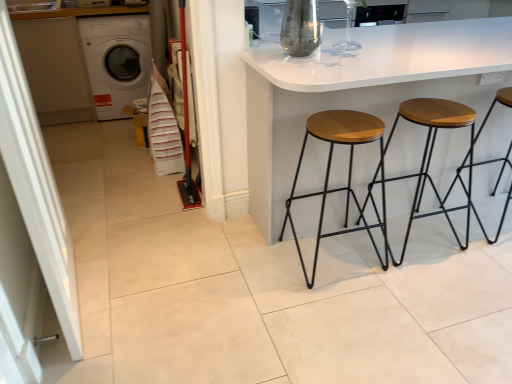
Where is `wooden/metallic stool at center, which is counted as the second stool, starting from the left`? This screenshot has width=512, height=384. wooden/metallic stool at center, which is counted as the second stool, starting from the left is located at coordinates tap(430, 157).

What do you see at coordinates (430, 157) in the screenshot? Image resolution: width=512 pixels, height=384 pixels. I see `wooden/metallic stool at center, which is counted as the second stool, starting from the left` at bounding box center [430, 157].

This screenshot has width=512, height=384. What are the coordinates of `wooden barstools at center` in the screenshot? It's located at (359, 90).

Image resolution: width=512 pixels, height=384 pixels. What do you see at coordinates (163, 129) in the screenshot? I see `white striped fabric at left` at bounding box center [163, 129].

Describe the element at coordinates (348, 173) in the screenshot. I see `woodenmaterial/texturestool at center, the 1th stool from the left` at that location.

This screenshot has width=512, height=384. Find the location of `woodenmaterial/texturestool at center, the 1th stool from the left`. woodenmaterial/texturestool at center, the 1th stool from the left is located at coordinates (348, 173).

What do you see at coordinates (348, 31) in the screenshot?
I see `transparent glass vase at upper center` at bounding box center [348, 31].

Find the location of a particular element. The width and height of the screenshot is (512, 384). wooden/metallic stool at center, which is counted as the second stool, starting from the left is located at coordinates (430, 157).

Consider the image. Can you tell me how much woodenmaterial/texturestool at center, marked as the 3th stool in a right-to-left arrangement, and transparent glass vase at upper center differ in facing direction?

There is a 178-degree angle between the facing directions of woodenmaterial/texturestool at center, marked as the 3th stool in a right-to-left arrangement, and transparent glass vase at upper center.

Which object is closer to the camera, woodenmaterial/texturestool at center, the 1th stool from the left, or transparent glass vase at upper center?

woodenmaterial/texturestool at center, the 1th stool from the left, is more forward.

Which is correct: woodenmaterial/texturestool at center, the 1th stool from the left, is inside transparent glass vase at upper center, or outside of it?

woodenmaterial/texturestool at center, the 1th stool from the left, is located beyond the bounds of transparent glass vase at upper center.

Does woodenmaterial/texturestool at center, marked as the 3th stool in a right-to-left arrangement, have a lesser height compared to transparent glass vase at upper center?

Incorrect, the height of woodenmaterial/texturestool at center, marked as the 3th stool in a right-to-left arrangement, does not fall short of that of transparent glass vase at upper center.

Visually, is wooden/metallic stool at center, which is counted as the second stool, starting from the left, positioned to the left or to the right of white striped fabric at left?

wooden/metallic stool at center, which is counted as the second stool, starting from the left, is positioned on white striped fabric at left's right side.

Who is taller, wooden/metallic stool at center, marked as the second stool in a right-to-left arrangement, or white striped fabric at left?

With more height is wooden/metallic stool at center, marked as the second stool in a right-to-left arrangement.

Is the surface of wooden/metallic stool at center, marked as the second stool in a right-to-left arrangement, in direct contact with white striped fabric at left?

wooden/metallic stool at center, marked as the second stool in a right-to-left arrangement, and white striped fabric at left are clearly separated.

From a real-world perspective, who is located higher, wooden/metallic stool at center, which is counted as the second stool, starting from the left, or white striped fabric at left?

From a 3D spatial view, wooden/metallic stool at center, which is counted as the second stool, starting from the left, is above.

Based on their positions, is wooden/metallic stool at center, marked as the second stool in a right-to-left arrangement, located to the left or right of white glossy washing machine at left?

In the image, wooden/metallic stool at center, marked as the second stool in a right-to-left arrangement, appears on the right side of white glossy washing machine at left.

Is point (453, 228) in front of point (111, 18)?

Yes.

Is wooden/metallic stool at center, marked as the second stool in a right-to-left arrangement, aimed at white glossy washing machine at left?

No, wooden/metallic stool at center, marked as the second stool in a right-to-left arrangement, is not facing towards white glossy washing machine at left.

From the image's perspective, is wooden/metallic stool at center, which is counted as the second stool, starting from the left, beneath white glossy washing machine at left?

Yes.

Where is `the 2nd stool below the wooden seat at right, the 3th stool in the left-to-right sequence (from the image's perspective)`? This screenshot has height=384, width=512. the 2nd stool below the wooden seat at right, the 3th stool in the left-to-right sequence (from the image's perspective) is located at coordinates (348, 173).

Is woodenmaterial/texturestool at center, marked as the 3th stool in a right-to-left arrangement, not close to wooden seat at right, positioned as the first stool in right-to-left order?

No, woodenmaterial/texturestool at center, marked as the 3th stool in a right-to-left arrangement, is in close proximity to wooden seat at right, positioned as the first stool in right-to-left order.

Which is farther, (297, 177) or (507, 100)?

The point (507, 100) is farther.

Which object is closer to the camera taking this photo, woodenmaterial/texturestool at center, the 1th stool from the left, or wooden seat at right, positioned as the first stool in right-to-left order?

woodenmaterial/texturestool at center, the 1th stool from the left, is more forward.

Is point (500, 93) more distant than point (320, 118)?

Yes, point (500, 93) is farther from viewer.

Would you say wooden seat at right, positioned as the first stool in right-to-left order, contains woodenmaterial/texturestool at center, the 1th stool from the left?

No, wooden seat at right, positioned as the first stool in right-to-left order, does not contain woodenmaterial/texturestool at center, the 1th stool from the left.

From a real-world perspective, is wooden seat at right, the 3th stool in the left-to-right sequence, under woodenmaterial/texturestool at center, the 1th stool from the left?

Correct, in the physical world, wooden seat at right, the 3th stool in the left-to-right sequence, is lower than woodenmaterial/texturestool at center, the 1th stool from the left.

Between wooden seat at right, the 3th stool in the left-to-right sequence, and woodenmaterial/texturestool at center, the 1th stool from the left, which one has smaller width?

Thinner between the two is woodenmaterial/texturestool at center, the 1th stool from the left.

Locate an element on the screen. The width and height of the screenshot is (512, 384). table located above the wooden/metallic stool at center, marked as the second stool in a right-to-left arrangement (from the image's perspective) is located at coordinates (359, 90).

Between wooden barstools at center and wooden/metallic stool at center, which is counted as the second stool, starting from the left, which one has smaller size?

wooden/metallic stool at center, which is counted as the second stool, starting from the left, is smaller.

Can you confirm if wooden barstools at center is shorter than wooden/metallic stool at center, which is counted as the second stool, starting from the left?

No.

Is wooden barstools at center facing away from wooden/metallic stool at center, which is counted as the second stool, starting from the left?

Correct, wooden barstools at center is looking away from wooden/metallic stool at center, which is counted as the second stool, starting from the left.

This screenshot has width=512, height=384. In order to click on stool that is the 2nd one when counting forward from the white glossy washing machine at left in this screenshot , I will do `click(430, 157)`.

Is the position of white glossy washing machine at left more distant than that of wooden/metallic stool at center, which is counted as the second stool, starting from the left?

Yes, white glossy washing machine at left is further from the camera.

Are white glossy washing machine at left and wooden/metallic stool at center, which is counted as the second stool, starting from the left, far apart?

Yes, white glossy washing machine at left and wooden/metallic stool at center, which is counted as the second stool, starting from the left, are quite far apart.

Could wooden/metallic stool at center, marked as the second stool in a right-to-left arrangement, be considered to be inside white glossy washing machine at left?

No, white glossy washing machine at left does not contain wooden/metallic stool at center, marked as the second stool in a right-to-left arrangement.

Find the location of `glass vase behind the woodenmaterial/texturestool at center, the 1th stool from the left`. glass vase behind the woodenmaterial/texturestool at center, the 1th stool from the left is located at coordinates (348, 31).

The width and height of the screenshot is (512, 384). I want to click on the 2nd stool above the white striped fabric at left (from a real-world perspective), so click(430, 157).

Which object lies nearer to the anchor point white glossy washing machine at left, transparent glass vase at upper center or wooden/metallic stool at center, which is counted as the second stool, starting from the left?

transparent glass vase at upper center is closer to white glossy washing machine at left.

From the image, which object appears to be farther from white glossy washing machine at left, woodenmaterial/texturestool at center, marked as the 3th stool in a right-to-left arrangement, or wooden seat at right, the 3th stool in the left-to-right sequence?

Among the two, wooden seat at right, the 3th stool in the left-to-right sequence, is located further to white glossy washing machine at left.

Considering their positions, is woodenmaterial/texturestool at center, the 1th stool from the left, positioned further to transparent glass vase at upper center than wooden barstools at center?

woodenmaterial/texturestool at center, the 1th stool from the left, lies further to transparent glass vase at upper center than the other object.

Which object lies further to the anchor point wooden barstools at center, wooden/metallic stool at center, marked as the second stool in a right-to-left arrangement, or white glossy washing machine at left?

white glossy washing machine at left is further to wooden barstools at center.

From the image, which object appears to be farther from white striped fabric at left, transparent glass vase at upper center or wooden barstools at center?

transparent glass vase at upper center lies further to white striped fabric at left than the other object.

Based on their spatial positions, is transparent glass vase at upper center or wooden barstools at center further from wooden seat at right, positioned as the first stool in right-to-left order?

transparent glass vase at upper center.

When comparing their distances from woodenmaterial/texturestool at center, the 1th stool from the left, does wooden barstools at center or white glossy washing machine at left seem closer?

Based on the image, wooden barstools at center appears to be nearer to woodenmaterial/texturestool at center, the 1th stool from the left.

Consider the image. From the image, which object appears to be nearer to transparent glass vase at upper center, wooden seat at right, positioned as the first stool in right-to-left order, or wooden/metallic stool at center, marked as the second stool in a right-to-left arrangement?

The object closer to transparent glass vase at upper center is wooden/metallic stool at center, marked as the second stool in a right-to-left arrangement.

At what (x,y) coordinates should I click in order to perform the action: click on glass vase located between white glossy washing machine at left and wooden barstools at center in the left-right direction. Please return your answer as a coordinate pair (x, y). This screenshot has height=384, width=512. Looking at the image, I should click on (348, 31).

This screenshot has height=384, width=512. In order to click on glass vase located between white striped fabric at left and wooden/metallic stool at center, marked as the second stool in a right-to-left arrangement, in the left-right direction in this screenshot , I will do `click(348, 31)`.

The width and height of the screenshot is (512, 384). What are the coordinates of `stool situated between woodenmaterial/texturestool at center, the 1th stool from the left, and wooden seat at right, the 3th stool in the left-to-right sequence, from left to right` in the screenshot? It's located at (430, 157).

Locate an element on the screen. Image resolution: width=512 pixels, height=384 pixels. stool between transparent glass vase at upper center and wooden seat at right, the 3th stool in the left-to-right sequence, in the horizontal direction is located at coordinates (430, 157).